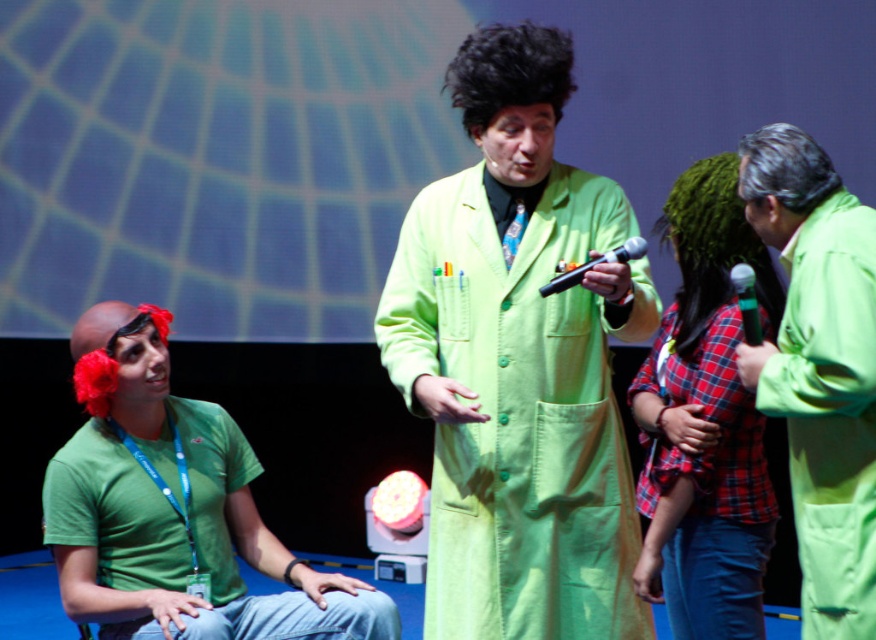
Question: Does red plaid shirt at center appear over black matte microphone at center?

Choices:
 (A) yes
 (B) no

Answer: (B)

Question: Which point appears closest to the camera in this image?

Choices:
 (A) (689, 300)
 (B) (121, 580)
 (C) (557, 275)
 (D) (836, 449)

Answer: (D)

Question: Does red plaid shirt at center appear over green matte microphone at right?

Choices:
 (A) no
 (B) yes

Answer: (A)

Question: Among these points, which one is farthest from the camera?

Choices:
 (A) (533, 76)
 (B) (851, 324)
 (C) (632, 241)

Answer: (A)

Question: Can you confirm if red plaid shirt at center is bigger than black matte microphone at center?

Choices:
 (A) no
 (B) yes

Answer: (B)

Question: Which object appears closest to the camera in this image?

Choices:
 (A) lime green lab coat at center
 (B) black matte microphone at center

Answer: (B)